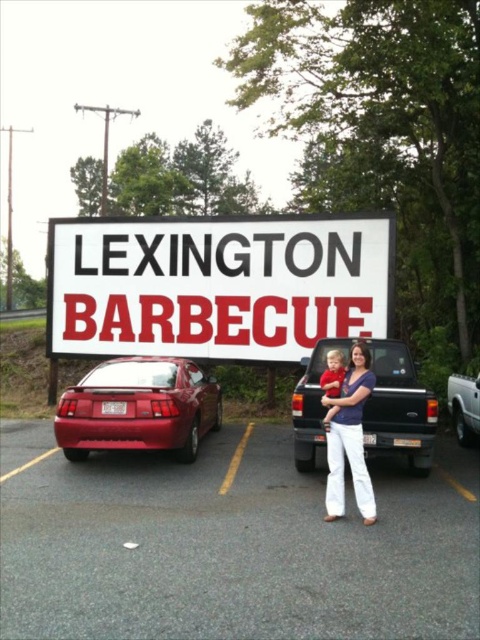
You are a delivery person who needs to park your orange matte truck at center in a spot that is to the right of the white cotton pants at center. Can you park your truck in the available spot?

The white cotton pants at center is positioned on the left side of orange matte truck at center, so the truck is already parked to the right of the white cotton pants at center. Therefore, the truck is already in the correct spot.

You are a photographer trying to capture the white plastic sign at center and the red cotton shirt at center in the same frame. Based on their sizes, which object should you focus on first to ensure both are in the frame?

The white plastic sign at center is taller than the red cotton shirt at center. To ensure both are in the frame, focus on the white plastic sign at center first since it requires more space vertically.

You are a delivery person trying to read the signboard clearly while standing in front of the white plastic sign at center and the red cotton shirt at center. Which object is wider so that you can focus on it better?

The white plastic sign at center is wider than the red cotton shirt at center, so you should focus on the white plastic sign at center for better visibility.